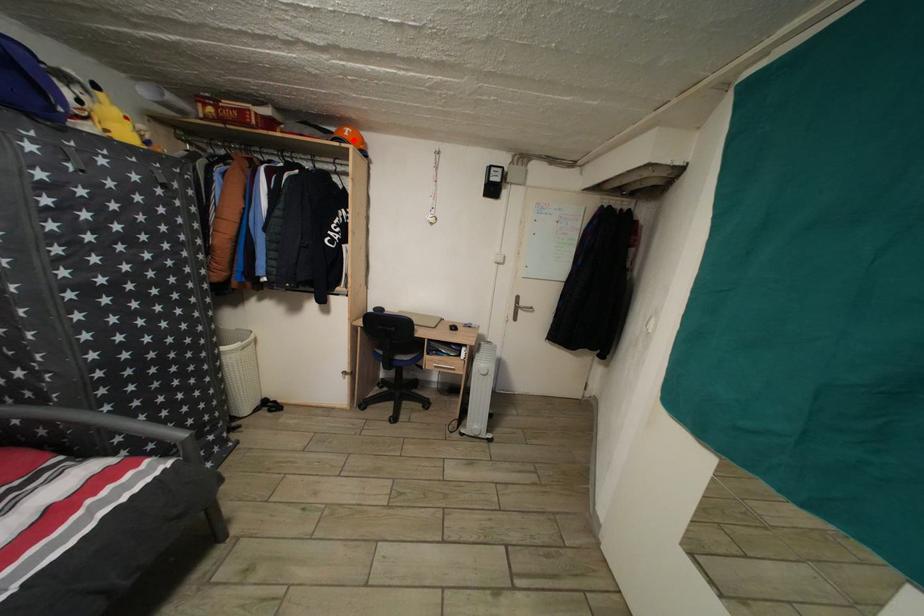
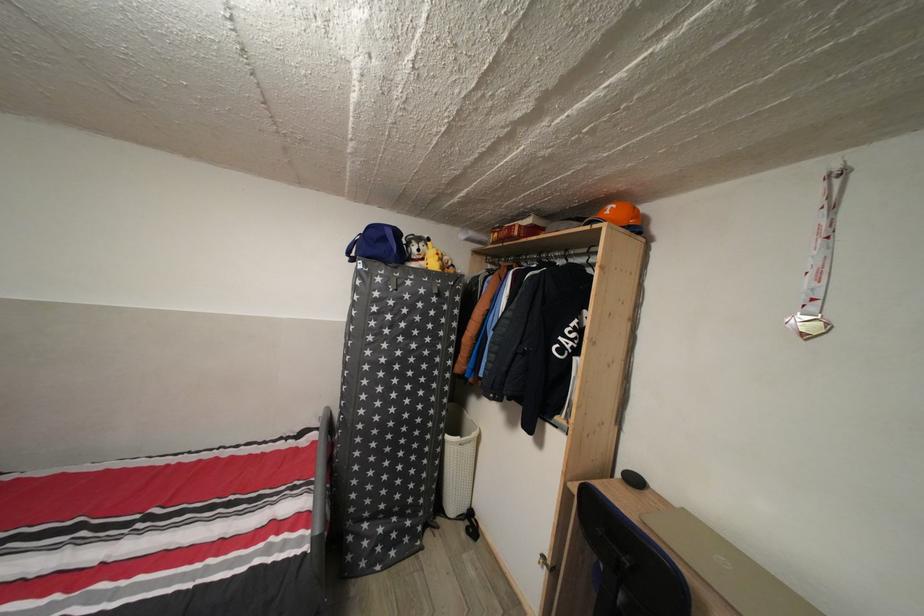
Find the pixel in the second image that matches the highlighted location in the first image.

(614, 219)